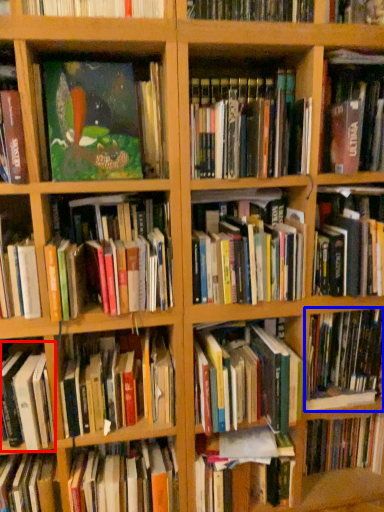
Question: Which object is further to the camera taking this photo, book (highlighted by a red box) or book (highlighted by a blue box)?

Choices:
 (A) book
 (B) book

Answer: (B)